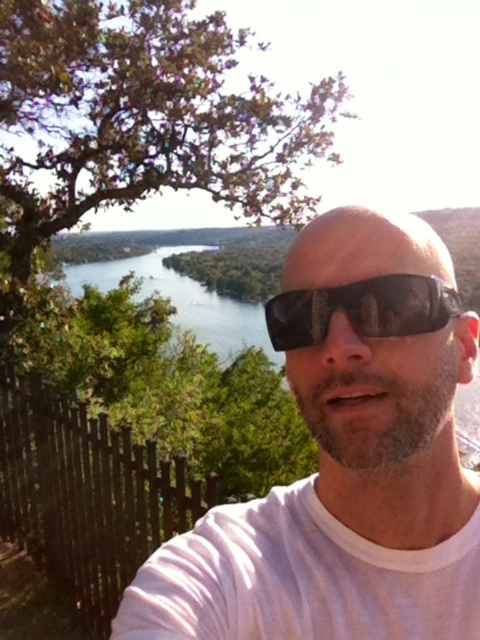
Is point (300, 237) farther from viewer compared to point (300, 310)?

Yes, point (300, 237) is farther from viewer.

Is point (360, 484) closer to camera compared to point (435, 278)?

No, (360, 484) is behind (435, 278).

The height and width of the screenshot is (640, 480). Describe the element at coordinates (344, 464) in the screenshot. I see `white matte sunglasses at center` at that location.

Identify the location of white matte sunglasses at center. (344, 464).